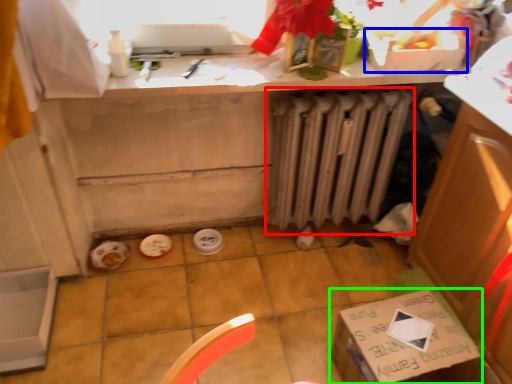
Question: Estimate the real-world distances between objects in this image. Which object is farther from radiator (highlighted by a red box), box (highlighted by a blue box) or cardboard box (highlighted by a green box)?

Choices:
 (A) box
 (B) cardboard box

Answer: (B)